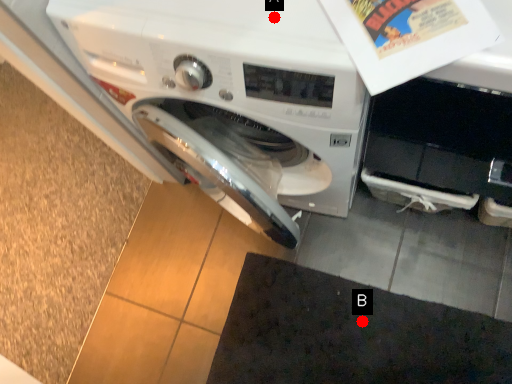
Question: Two points are circled on the image, labeled by A and B beside each circle. Which point is closer to the camera taking this photo?

Choices:
 (A) A is closer
 (B) B is closer

Answer: (A)